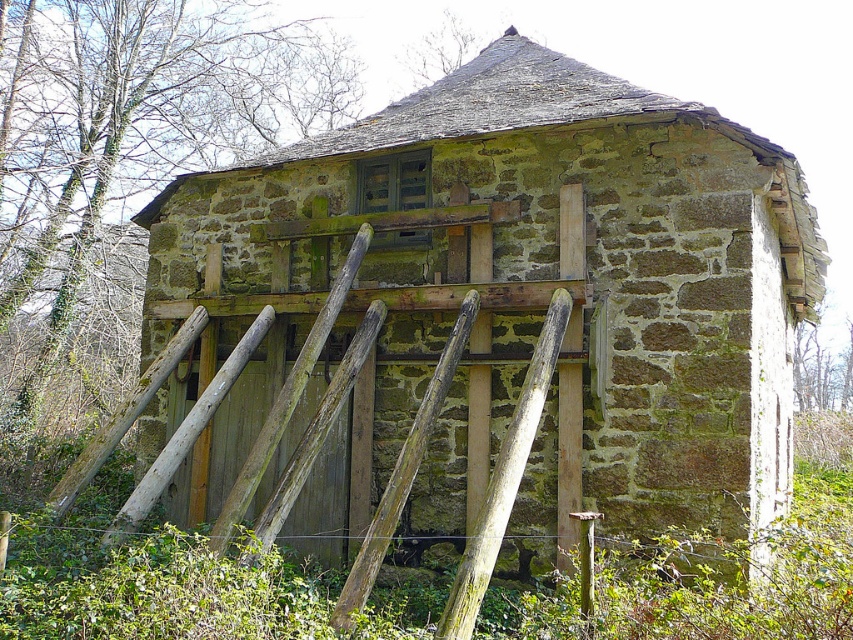
Question: Is smooth wooden plank at center thinner than weathered wood at center?

Choices:
 (A) yes
 (B) no

Answer: (B)

Question: Does smooth wooden plank at center appear under weathered wood at center?

Choices:
 (A) yes
 (B) no

Answer: (B)

Question: Is smooth wooden plank at center to the right of weathered wood at center from the viewer's perspective?

Choices:
 (A) yes
 (B) no

Answer: (A)

Question: Among these points, which one is farthest from the camera?

Choices:
 (A) (350, 589)
 (B) (467, 624)

Answer: (A)

Question: Among these points, which one is nearest to the camera?

Choices:
 (A) (450, 356)
 (B) (561, 337)

Answer: (B)